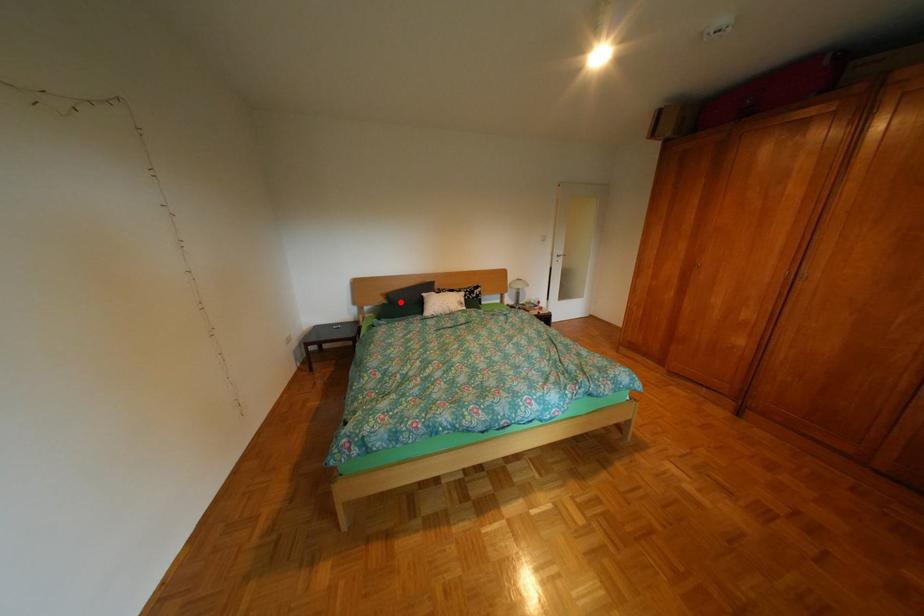
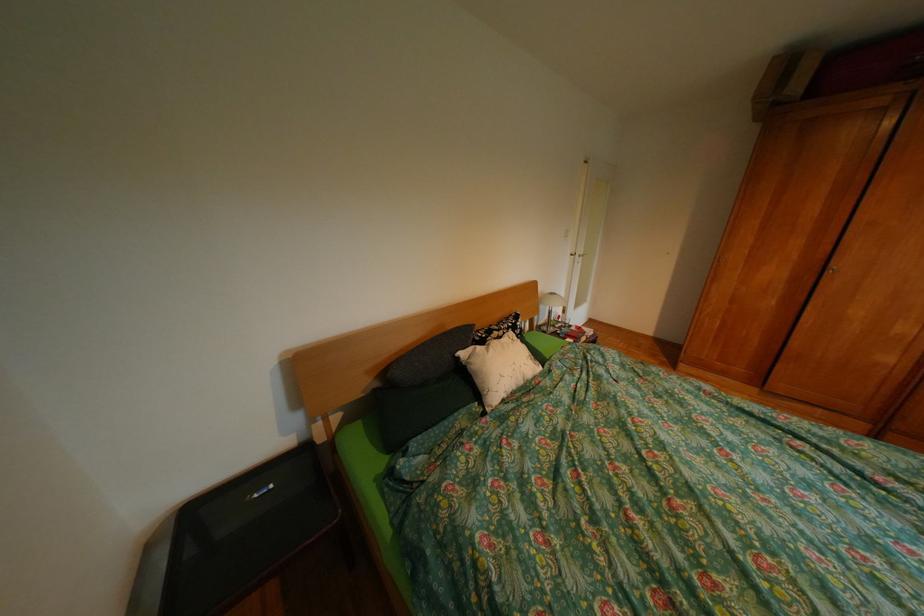
Where in the second image is the point corresponding to the highlighted location from the first image?

(392, 385)